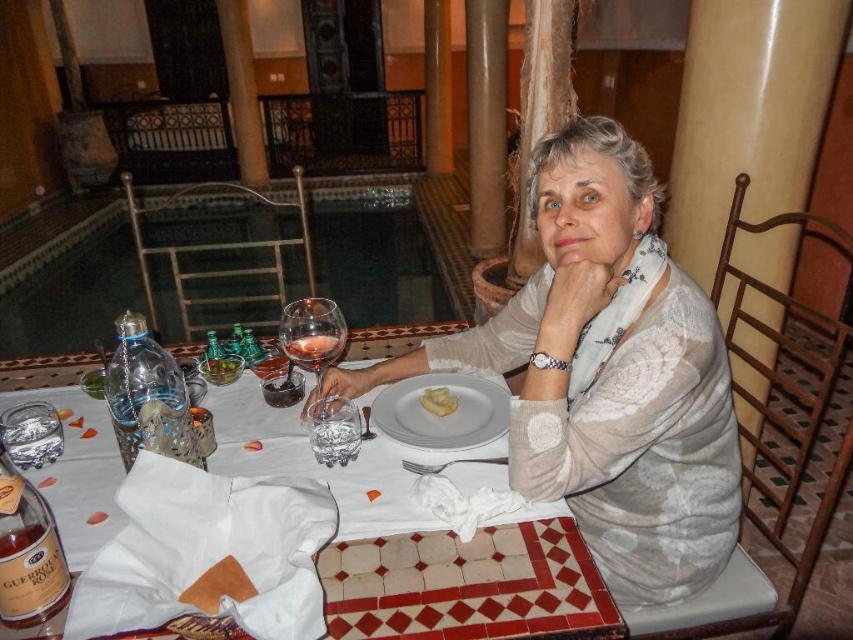
Question: Can you confirm if white cloth at center is positioned below green leafy vegetables at center?

Choices:
 (A) yes
 (B) no

Answer: (A)

Question: Which point is closer to the camera?

Choices:
 (A) white matte plate at center
 (B) translucent glass wine glass at center
 (C) amber glass bottle at lower left

Answer: (C)

Question: Which point appears closest to the camera in this image?

Choices:
 (A) (318, 371)
 (B) (292, 353)
 (C) (433, 401)
 (D) (115, 424)

Answer: (D)

Question: Can you confirm if transparent glass pool at center is bigger than clear plastic bottle at table left?

Choices:
 (A) yes
 (B) no

Answer: (A)

Question: Which point is closer to the camera taking this photo?

Choices:
 (A) (4, 484)
 (B) (495, 400)
 (C) (341, 412)
 (D) (213, 365)

Answer: (A)

Question: From the image, what is the correct spatial relationship of white cloth at center in relation to translucent glass wine glass at center?

Choices:
 (A) below
 (B) above

Answer: (A)